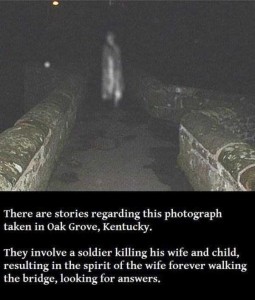
Locate an element on the screen. The height and width of the screenshot is (300, 255). light is located at coordinates (55, 4).